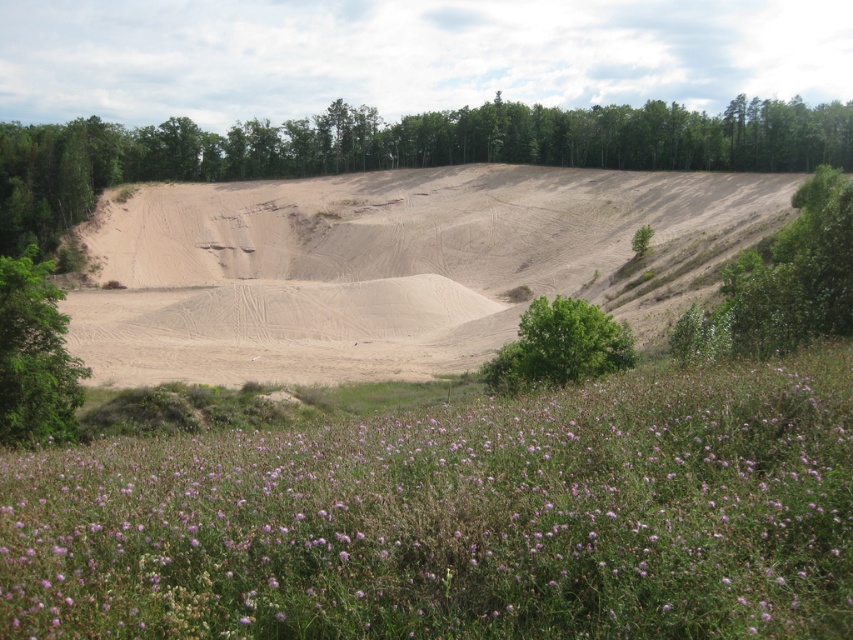
You are standing at the edge of the sandy terrain and want to reach the light brown sand dune at center. Which direction should you move relative to the purple grass at lower center?

You should move upwards away from the purple grass at lower center to reach the light brown sand dune at center since the purple grass is located below it.

You are standing at the edge of the sandy terrain and want to climb the highest object in sight. Which one should you choose between the light brown sand dune at center and the green leafy tree at right?

The light brown sand dune at center is taller than the green leafy tree at right, so you should choose the light brown sand dune at center to climb for the highest point.